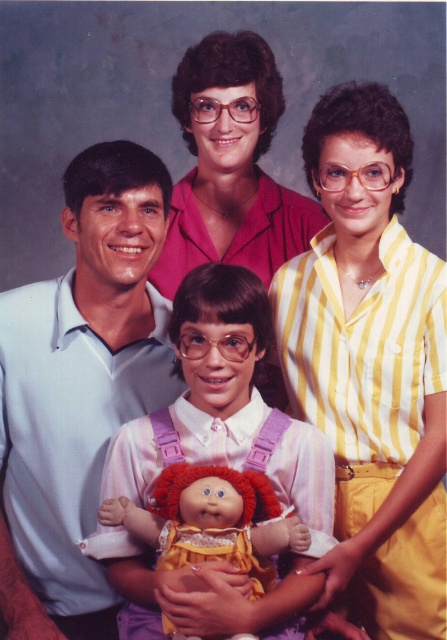
Which of these two, yellow striped shirt at upper right or plush fabric doll at center, stands taller?

With more height is yellow striped shirt at upper right.

From the picture: Between yellow striped shirt at upper right and plush fabric doll at center, which one has less height?

plush fabric doll at center is shorter.

Between point (341, 465) and point (123, 515), which one is positioned in front?

Point (123, 515) is in front.

Where is `yellow striped shirt at upper right`? The image size is (447, 640). yellow striped shirt at upper right is located at coordinates coord(371,364).

Between point (58, 333) and point (244, 529), which one is positioned in front?

Point (244, 529) is more forward.

Who is higher up, light blue cotton shirt at left or plush fabric doll at center?

light blue cotton shirt at left is higher up.

This screenshot has height=640, width=447. I want to click on light blue cotton shirt at left, so click(x=83, y=372).

Is yellow striped shirt at upper right further to camera compared to light blue cotton shirt at left?

No, it is not.

Who is positioned more to the right, yellow striped shirt at upper right or light blue cotton shirt at left?

Positioned to the right is yellow striped shirt at upper right.

Which is behind, point (386, 625) or point (21, 365)?

Point (386, 625)

This screenshot has height=640, width=447. What are the coordinates of `yellow striped shirt at upper right` in the screenshot? It's located at (371, 364).